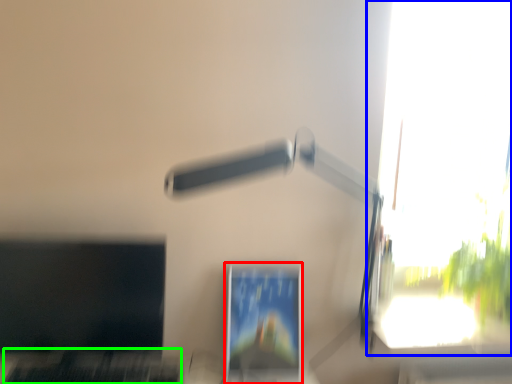
Question: Which object is positioned farthest from computer monitor (highlighted by a red box)? Select from window (highlighted by a blue box) and laptop keyboard (highlighted by a green box).

Choices:
 (A) window
 (B) laptop keyboard

Answer: (A)